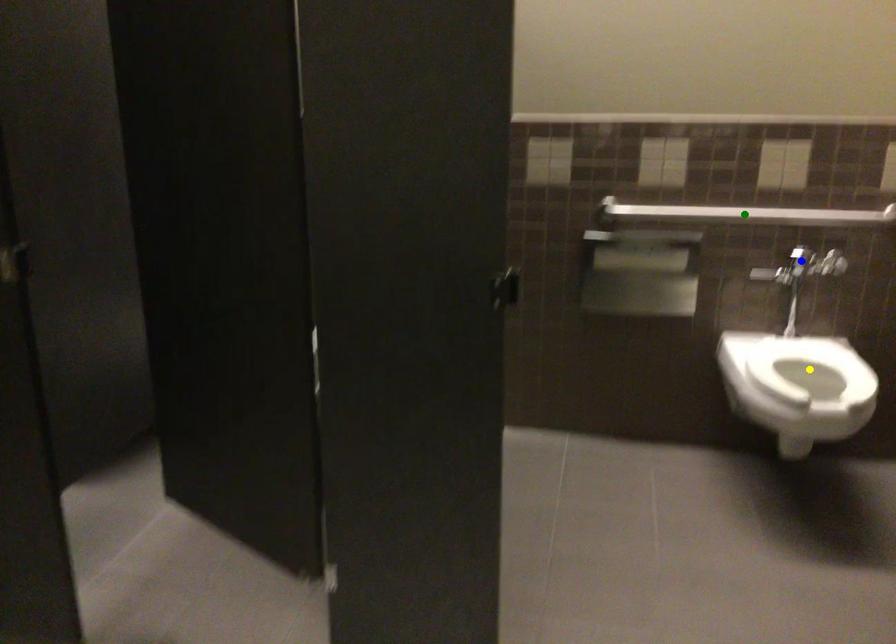
From the picture: Order these from nearest to farthest:
1. blue point
2. green point
3. yellow point

yellow point → green point → blue point